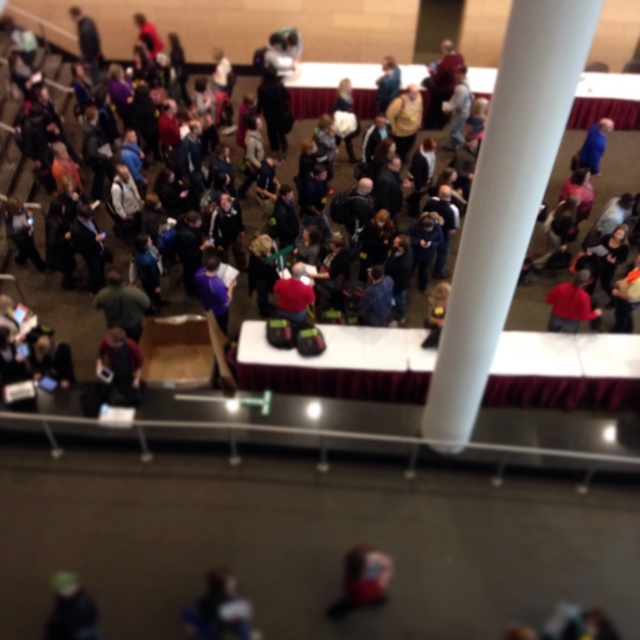
Question: Estimate the real-world distances between objects in this image. Which object is farther from the red matte shirt at center?

Choices:
 (A) dark gray hoodie at center
 (B) green knit hat at lower left

Answer: (B)

Question: Which point is farther from the camera taking this photo?

Choices:
 (A) (557, 294)
 (B) (369, 35)
 (C) (74, 612)

Answer: (B)

Question: Which point appears farthest from the camera in this image?

Choices:
 (A) (202, 19)
 (B) (77, 620)
 (C) (556, 316)

Answer: (A)

Question: Can you confirm if dark gray hoodie at center is positioned to the right of green knit hat at lower left?

Choices:
 (A) yes
 (B) no

Answer: (A)

Question: Does green knit hat at lower left have a larger size compared to red matte shirt at center?

Choices:
 (A) no
 (B) yes

Answer: (A)

Question: Does dark gray hoodie at center appear on the left side of green knit hat at lower left?

Choices:
 (A) yes
 (B) no

Answer: (B)